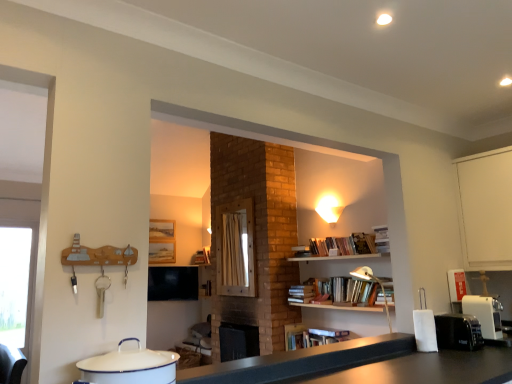
Identify the location of white plastic coffee machine at lower right. (485, 314).

Where is `black plastic toaster at right, which appears as the first appliance when viewed from the right`? This screenshot has width=512, height=384. black plastic toaster at right, which appears as the first appliance when viewed from the right is located at coordinates (458, 332).

At what (x,y) coordinates should I click in order to perform the action: click on matte white lampshade at upper center. Please return your answer as a coordinate pair (x, y). The height and width of the screenshot is (384, 512). Looking at the image, I should click on (329, 209).

Identify the location of wooden frame at center. This screenshot has width=512, height=384. (234, 249).

What do you see at coordinates (234, 249) in the screenshot? The height and width of the screenshot is (384, 512). I see `wooden frame at center` at bounding box center [234, 249].

Measure the distance between hardcover book at upper right and camera.

hardcover book at upper right and camera are 3.54 meters apart.

Identify the location of white plastic coffee machine at lower right. (485, 314).

Is black matte counter top at center smaller than hardcover book at upper right?

Yes.

Does black matte counter top at center appear on the right side of hardcover book at upper right?

Incorrect, black matte counter top at center is not on the right side of hardcover book at upper right.

From a real-world perspective, between black matte counter top at center and hardcover book at upper right, who is vertically higher?

In real-world perspective, hardcover book at upper right is above.

Can you tell me how much white enamel pot at lower left, the 1th appliance from the left, and wooden frame at center differ in facing direction?

The facing directions of white enamel pot at lower left, the 1th appliance from the left, and wooden frame at center are 90.1 degrees apart.

Looking at this image, from the image's perspective, which is above, white enamel pot at lower left, the 1th appliance from the left, or wooden frame at center?

white enamel pot at lower left, the 1th appliance from the left, from the image's perspective.

Between white enamel pot at lower left, positioned as the first appliance in front-to-back order, and wooden frame at center, which one has larger size?

wooden frame at center is bigger.

Would you consider white enamel pot at lower left, acting as the first appliance starting from the top, to be distant from wooden frame at center?

Yes, white enamel pot at lower left, acting as the first appliance starting from the top, and wooden frame at center are located far from each other.

Is wooden frame at center oriented away from matte white lampshade at upper center?

No, wooden frame at center is not facing away from matte white lampshade at upper center.

In the image, is wooden frame at center on the left side or the right side of matte white lampshade at upper center?

In the image, wooden frame at center appears on the left side of matte white lampshade at upper center.

Looking at this image, from a real-world perspective, between wooden frame at center and matte white lampshade at upper center, who is vertically lower?

wooden frame at center.

Is white enamel pot at lower left, the 1th appliance from the left, wider or thinner than metallic silver lamp at upper right?

Considering their sizes, white enamel pot at lower left, the 1th appliance from the left, looks slimmer than metallic silver lamp at upper right.

Considering the sizes of objects white enamel pot at lower left, the 2th appliance positioned from the bottom, and metallic silver lamp at upper right in the image provided, who is taller, white enamel pot at lower left, the 2th appliance positioned from the bottom, or metallic silver lamp at upper right?

metallic silver lamp at upper right.

Based on the photo, is white enamel pot at lower left, acting as the first appliance starting from the top, next to metallic silver lamp at upper right and touching it?

white enamel pot at lower left, acting as the first appliance starting from the top, and metallic silver lamp at upper right are not in contact.

Is white plastic coffee machine at lower right thinner than white enamel pot at lower left, the 2th appliance positioned from the bottom?

No.

What's the angular difference between white plastic coffee machine at lower right and white enamel pot at lower left, the 2th appliance positioned from the bottom,'s facing directions?

They differ by 1.6 degrees in their facing directions.

Is the depth of white plastic coffee machine at lower right greater than that of white enamel pot at lower left, positioned as the first appliance in front-to-back order?

Yes, it is.

I want to click on book on the left of black plastic toaster at right, the 2th appliance viewed from the top, so click(x=381, y=239).

Considering the points (474, 334) and (378, 228), which point is in front, point (474, 334) or point (378, 228)?

The point (474, 334) is more forward.

Is black plastic toaster at right, positioned as the 1th appliance in bottom-to-top order, facing towards hardcover book at upper right?

No.

Considering the sizes of objects black plastic toaster at right, the 2th appliance viewed from the top, and hardcover book at upper right in the image provided, who is shorter, black plastic toaster at right, the 2th appliance viewed from the top, or hardcover book at upper right?

black plastic toaster at right, the 2th appliance viewed from the top.

From a real-world perspective, is hardcover book at upper right on top of matte white lampshade at upper center?

Actually, hardcover book at upper right is physically below matte white lampshade at upper center in the real world.

Is hardcover book at upper right not within matte white lampshade at upper center?

hardcover book at upper right is positioned outside matte white lampshade at upper center.

Based on the photo, is hardcover book at upper right oriented away from matte white lampshade at upper center?

hardcover book at upper right is not turned away from matte white lampshade at upper center.

Who is smaller, hardcover book at upper right or matte white lampshade at upper center?

Smaller between the two is hardcover book at upper right.

Identify the location of counter top below the hardcover book at upper right (from the image's perspective). (361, 365).

You are a GUI agent. You are given a task and a screenshot of the screen. Output one action in this format:
    pyautogui.click(x=<x>, y=<y>)
    Task: Click on the window screen that appears behind the white enamel pot at lower left, positioned as the first appliance in front-to-back order
    The width and height of the screenshot is (512, 384).
    Given the screenshot: What is the action you would take?
    pyautogui.click(x=234, y=249)

In the scene shown: Estimate the real-world distances between objects in this image. Which object is further from metallic silver lamp at upper right, wooden frame at center or black plastic toaster at right, which appears as the first appliance when viewed from the right?

wooden frame at center.

Estimate the real-world distances between objects in this image. Which object is further from metallic silver lamp at upper right, black matte counter top at center or matte white lampshade at upper center?

black matte counter top at center is positioned further to the anchor metallic silver lamp at upper right.

Considering their positions, is hardcover book at upper right positioned closer to matte white lampshade at upper center than white plastic coffee machine at lower right?

hardcover book at upper right is closer to matte white lampshade at upper center.

Estimate the real-world distances between objects in this image. Which object is closer to wooden frame at center, metallic silver lamp at upper right or black plastic toaster at right, which appears as the first appliance when viewed from the right?

metallic silver lamp at upper right lies closer to wooden frame at center than the other object.

From the image, which object appears to be farther from black plastic toaster at right, the second appliance when ordered from front to back, matte white lampshade at upper center or white plastic coffee machine at lower right?

matte white lampshade at upper center lies further to black plastic toaster at right, the second appliance when ordered from front to back, than the other object.

From the picture: Based on their spatial positions, is black plastic toaster at right, the second appliance when ordered from front to back, or black matte counter top at center further from metallic silver lamp at upper right?

Based on the image, black matte counter top at center appears to be further to metallic silver lamp at upper right.

Looking at the image, which one is located closer to black plastic toaster at right, acting as the 2th appliance starting from the left, white plastic coffee machine at lower right or metallic silver lamp at upper right?

white plastic coffee machine at lower right.

From the image, which object appears to be farther from hardcover book at upper right, matte white lampshade at upper center or white enamel pot at lower left, the 1th appliance from the left?

Among the two, white enamel pot at lower left, the 1th appliance from the left, is located further to hardcover book at upper right.

Where is `lamp located between white enamel pot at lower left, arranged as the 2th appliance when viewed from the back, and hardcover book at upper right in the depth direction`? lamp located between white enamel pot at lower left, arranged as the 2th appliance when viewed from the back, and hardcover book at upper right in the depth direction is located at coordinates (375, 281).

This screenshot has width=512, height=384. Identify the location of coffee machine positioned between black plastic toaster at right, acting as the 2th appliance starting from the left, and wooden frame at center from near to far. (485, 314).

Find the location of `counter top positioned between white enamel pot at lower left, positioned as the first appliance in front-to-back order, and metallic silver lamp at upper right from near to far`. counter top positioned between white enamel pot at lower left, positioned as the first appliance in front-to-back order, and metallic silver lamp at upper right from near to far is located at coordinates (361, 365).

Locate an element on the screen. This screenshot has width=512, height=384. lamp between black matte counter top at center and matte white lampshade at upper center from front to back is located at coordinates (375, 281).